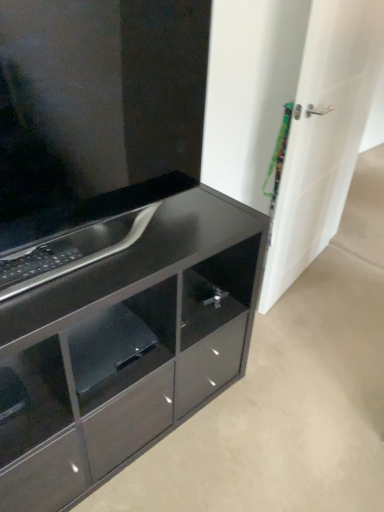
At what (x,y) coordinates should I click in order to perform the action: click on spots to the right of white glossy door at right. Please return your answer as a coordinate pair (x, y). The image size is (384, 512). Looking at the image, I should click on (345, 273).